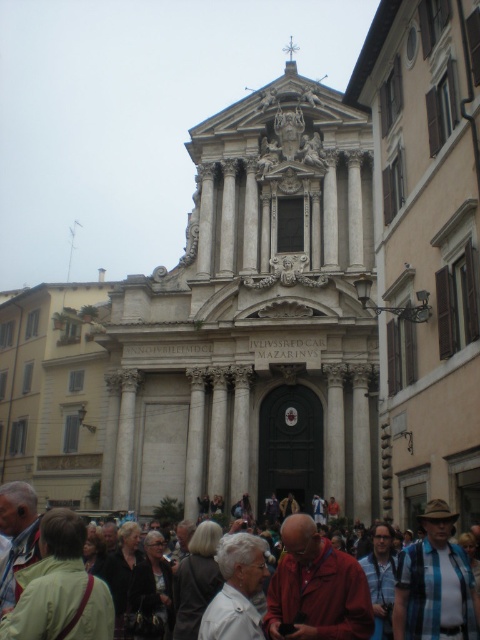
You are standing in front of the grand classical building and want to walk from the first point to the second point. Can you directly walk from point (x=40, y=570) to point (x=202, y=532) without any obstacles?

Point (x=40, y=570) is in front of point (x=202, y=532), so yes, you can directly walk from point (x=40, y=570) to point (x=202, y=532) without any obstacles.

You are a tour guide leading a group to a historical monument. You notice two visitors wearing a dark gray sweater at center and a white textured jacket at center. Your group needs to pass between them to reach the entrance. If your group is 2 meters wide, can they safely pass through the space between the two visitors?

The distance between the dark gray sweater at center and the white textured jacket at center is 5.91 meters. Since the group is 2 meters wide, they can safely pass through the space between the two visitors as the distance is more than sufficient.

You are a photographer standing in front of the classical building. You want to take a photo that includes both the light beige fabric purse at lower left and the dark gray sweater at center. Which object should you adjust your camera angle to focus on first if you want to ensure both are in frame?

The light beige fabric purse at lower left is shorter than the dark gray sweater at center, so you should focus on the dark gray sweater at center first to ensure the shorter purse is also captured in the frame.